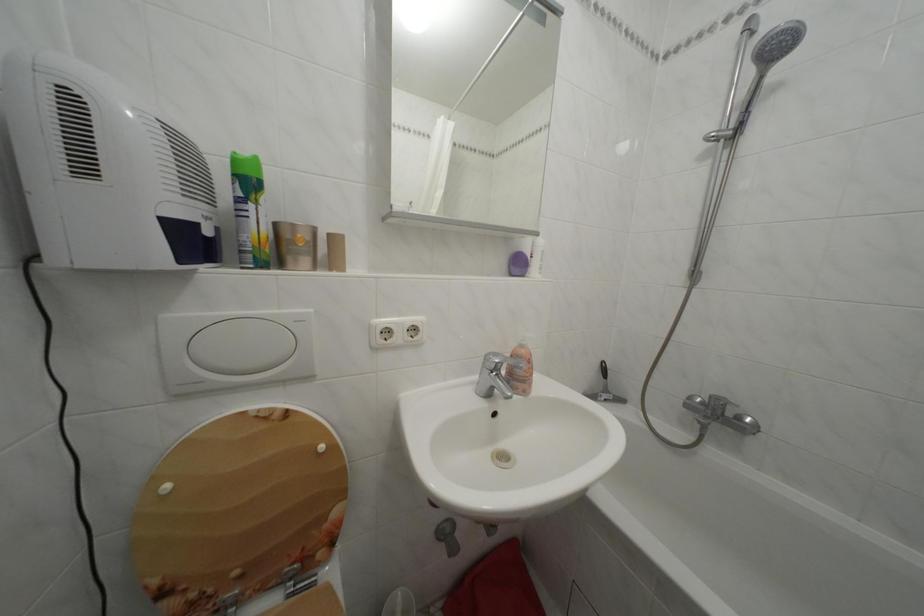
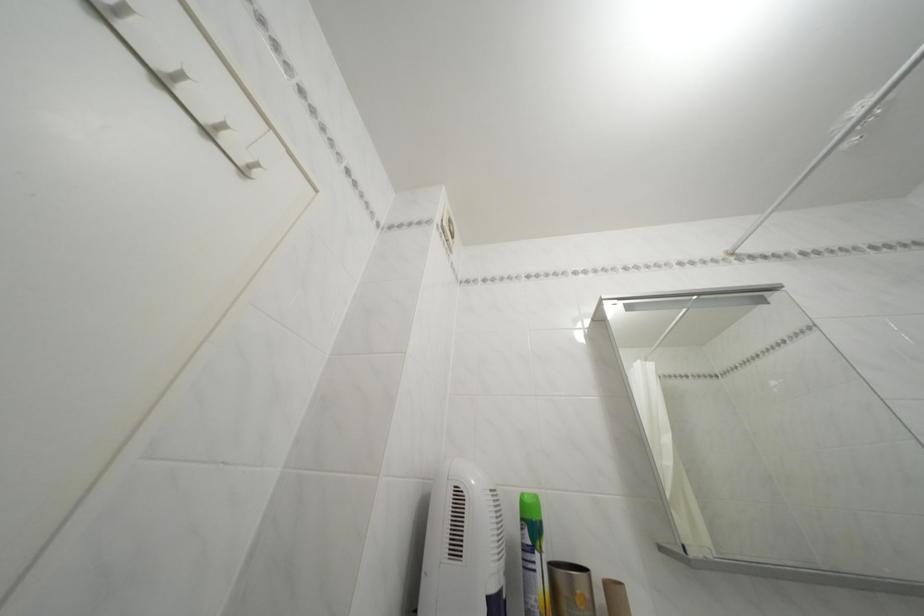
Find the pixel in the second image that matches (337,241) in the first image.

(614, 591)